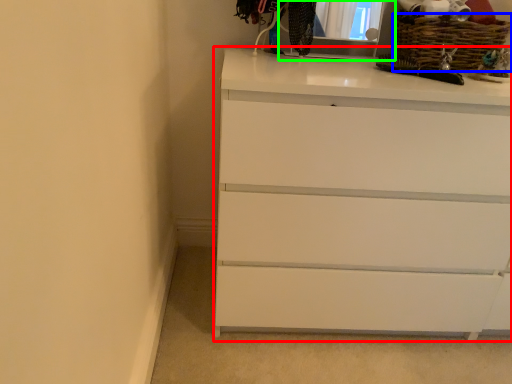
Question: Estimate the real-world distances between objects in this image. Which object is farther from chest of drawers (highlighted by a red box), basket (highlighted by a blue box) or medicine cabinet (highlighted by a green box)?

Choices:
 (A) basket
 (B) medicine cabinet

Answer: (B)